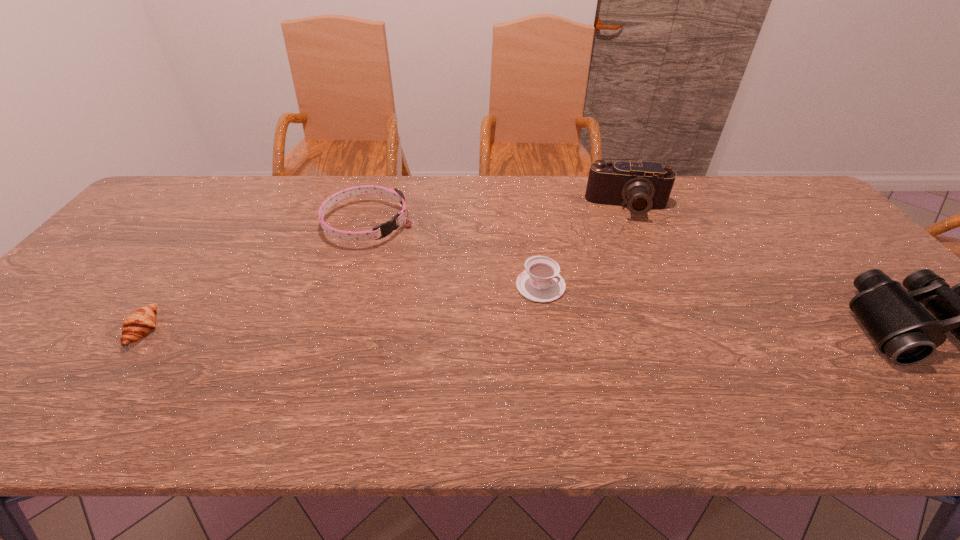
This screenshot has width=960, height=540. I want to click on the shortest object, so click(137, 325).

Where is `the leftmost object`? This screenshot has width=960, height=540. the leftmost object is located at coordinates [137, 325].

I want to click on the second object from right to left, so coord(640,186).

This screenshot has height=540, width=960. What are the coordinates of `dog collar` in the screenshot? It's located at (387, 228).

The width and height of the screenshot is (960, 540). I want to click on the third object from right to left, so click(x=541, y=282).

Locate an element on the screen. This screenshot has width=960, height=540. vacant space located on the front-facing side of the shortest object is located at coordinates (325, 329).

Identify the location of vacant space located on the front-facing side of the camera. The height and width of the screenshot is (540, 960). (630, 252).

At what (x,y) coordinates should I click in order to perform the action: click on vacant space located on the front-facing side of the camera. Please return your answer as a coordinate pair (x, y). The image size is (960, 540). Looking at the image, I should click on (630, 254).

Where is `vacant space located on the front-facing side of the camera`? The image size is (960, 540). vacant space located on the front-facing side of the camera is located at coordinates (628, 233).

What are the coordinates of `blank space located with the buckle on the second object from left to right` in the screenshot? It's located at (479, 287).